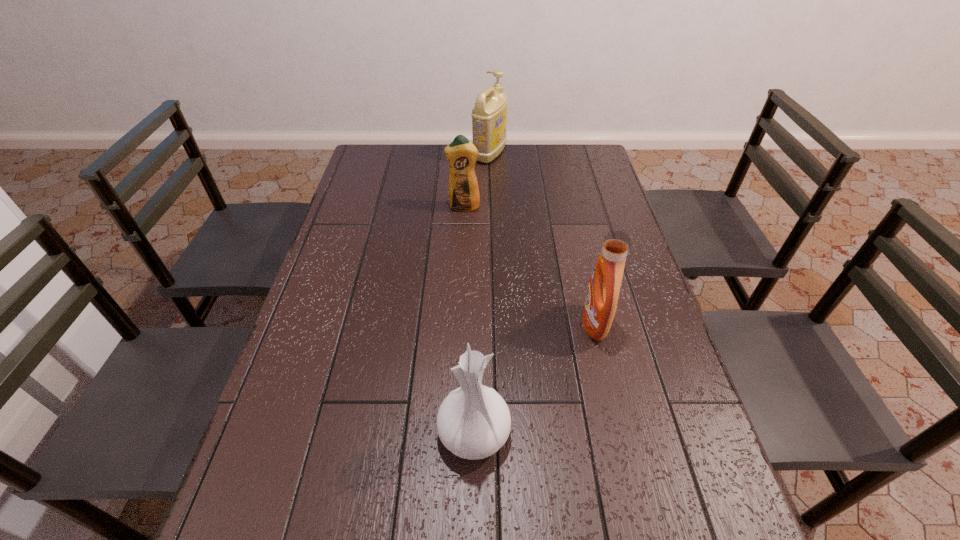
In order to click on vacant area between the nearest detergent and the second farthest object in this screenshot , I will do `click(529, 266)`.

The height and width of the screenshot is (540, 960). Identify the location of vacant space that is in between the rightmost detergent and the nearest object. (x=534, y=378).

Identify the location of empty space that is in between the rightmost object and the vase. Image resolution: width=960 pixels, height=540 pixels. (534, 378).

Where is `free space between the vase and the third farthest object`? This screenshot has width=960, height=540. free space between the vase and the third farthest object is located at coordinates (534, 378).

What are the coordinates of `free spot between the farthest object and the rightmost detergent` in the screenshot? It's located at (542, 239).

Where is `free space between the farthest object and the rightmost detergent`? free space between the farthest object and the rightmost detergent is located at coordinates (542, 239).

This screenshot has width=960, height=540. Identify the location of object that ranks as the second closest to the nearest detergent. (461, 154).

Identify which object is the third nearest to the vase. Please provide its 2D coordinates. Your answer should be formatted as a tuple, i.e. [(x, y)], where the tuple contains the x and y coordinates of a point satisfying the conditions above.

[(489, 116)]

The height and width of the screenshot is (540, 960). In order to click on detergent that is the second closest to the second farthest object in this screenshot , I will do `click(603, 290)`.

Where is `the closest detergent to the nearest object`? the closest detergent to the nearest object is located at coordinates [x=603, y=290].